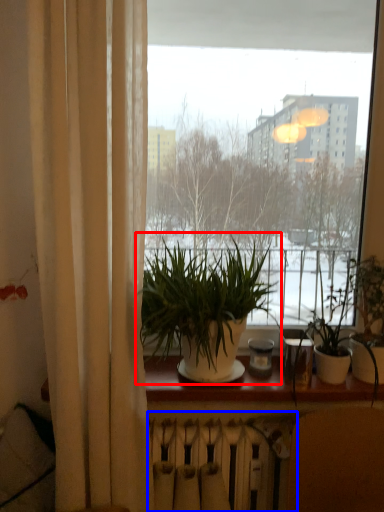
Question: Among these objects, which one is nearest to the camera, houseplant (highlighted by a red box) or radiator (highlighted by a blue box)?

Choices:
 (A) houseplant
 (B) radiator

Answer: (A)